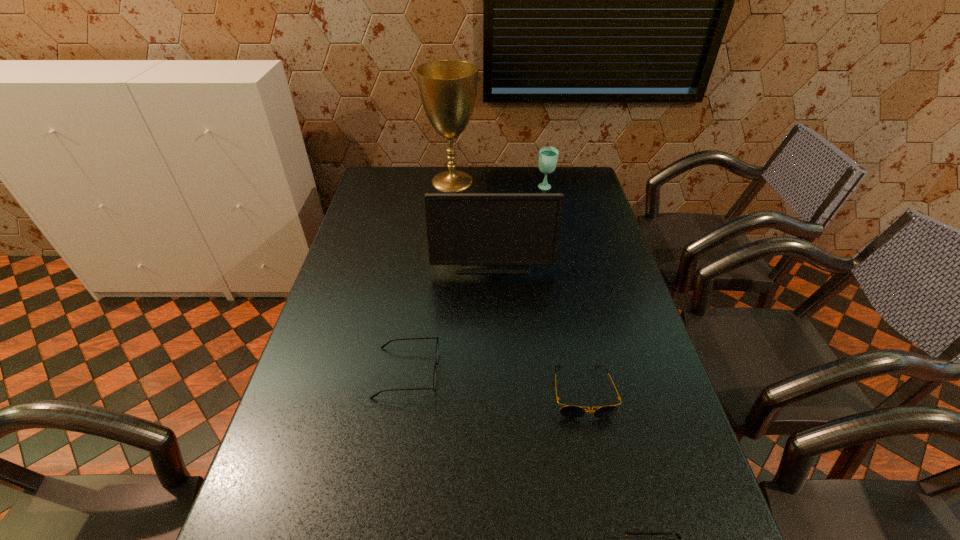
Identify the location of empty location between the trophy cup and the sunglasses. Image resolution: width=960 pixels, height=540 pixels. (517, 287).

You are a GUI agent. You are given a task and a screenshot of the screen. Output one action in this format:
    pyautogui.click(x=<x>, y=<y>)
    Task: Click on the free space between the sunglasses and the taller spectacles
    Image resolution: width=960 pixels, height=540 pixels.
    Given the screenshot: What is the action you would take?
    pyautogui.click(x=494, y=382)

Find the location of a particular element. vacant space in between the sunglasses and the trophy cup is located at coordinates (517, 287).

Find the location of a particular element. Image resolution: width=960 pixels, height=540 pixels. blank region between the tallest object and the left spectacles is located at coordinates (430, 277).

Image resolution: width=960 pixels, height=540 pixels. Find the location of `vacant area that lies between the sunglasses and the taller spectacles`. vacant area that lies between the sunglasses and the taller spectacles is located at coordinates (494, 382).

What are the coordinates of `unoccupied position between the computer monitor and the sunglasses` in the screenshot? It's located at (538, 326).

At what (x,y) coordinates should I click in order to perform the action: click on the third closest object to the sunglasses. Please return your answer as a coordinate pair (x, y). Looking at the image, I should click on (524, 229).

Point out which object is positioned as the nearest to the taller spectacles. Please provide its 2D coordinates. Your answer should be formatted as a tuple, i.e. [(x, y)], where the tuple contains the x and y coordinates of a point satisfying the conditions above.

[(569, 411)]

Where is `free spot that satisfies the following two spatial constraints: 1. on the front side of the glass; 2. on the front-facing side of the farther spectacles`? This screenshot has height=540, width=960. free spot that satisfies the following two spatial constraints: 1. on the front side of the glass; 2. on the front-facing side of the farther spectacles is located at coordinates (584, 373).